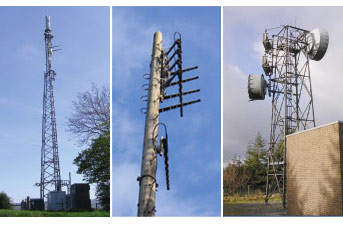
This screenshot has height=226, width=343. I want to click on brick wall, so click(x=319, y=171).